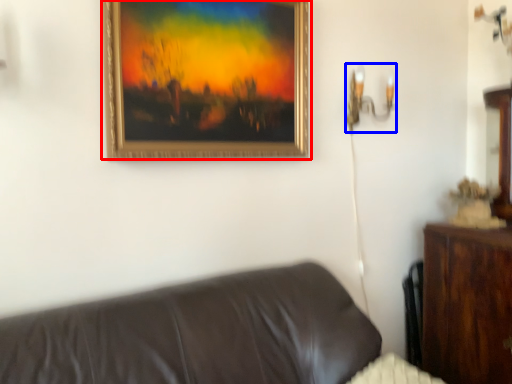
Question: Which object is closer to the camera taking this photo, picture frame (highlighted by a red box) or table lamp (highlighted by a blue box)?

Choices:
 (A) picture frame
 (B) table lamp

Answer: (A)